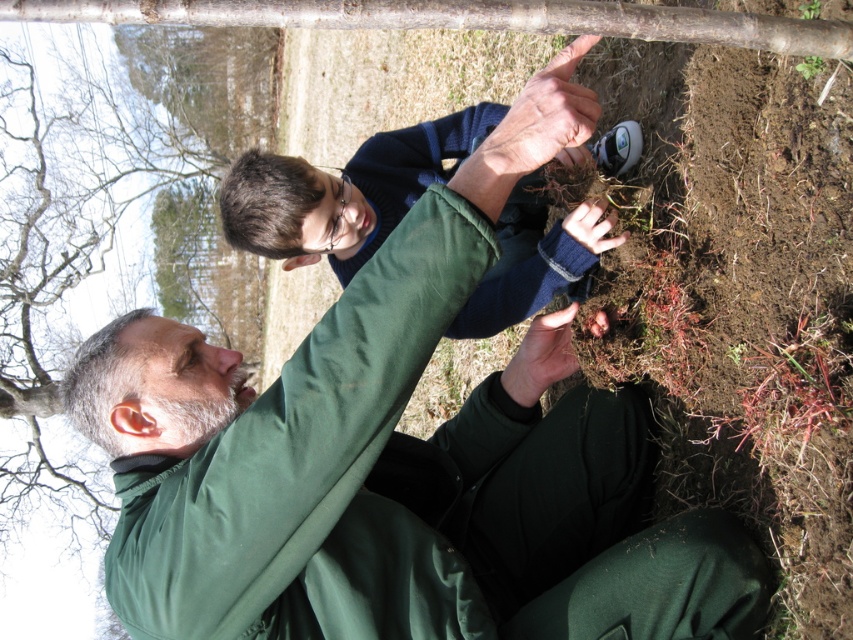
In the scene shown: You are standing at the origin of a coordinate system where the image is mapped to a grid from 0 to 1 in both x and y directions. The point at coordinate (393, 477) is marked. Which object is located at that point? Please answer with the exact object label from the objects list.

The point at coordinate (393, 477) corresponds to the green matte jacket at center.

You are trying to decide whether to place a new small potted plant between the green matte jacket at center and the green matte tree at upper center. Based on their sizes, which object should the potted plant be closer to?

The green matte jacket at center is smaller than the green matte tree at upper center. Therefore, the potted plant should be placed closer to the green matte tree at upper center since it is larger and can accommodate a larger space between them.